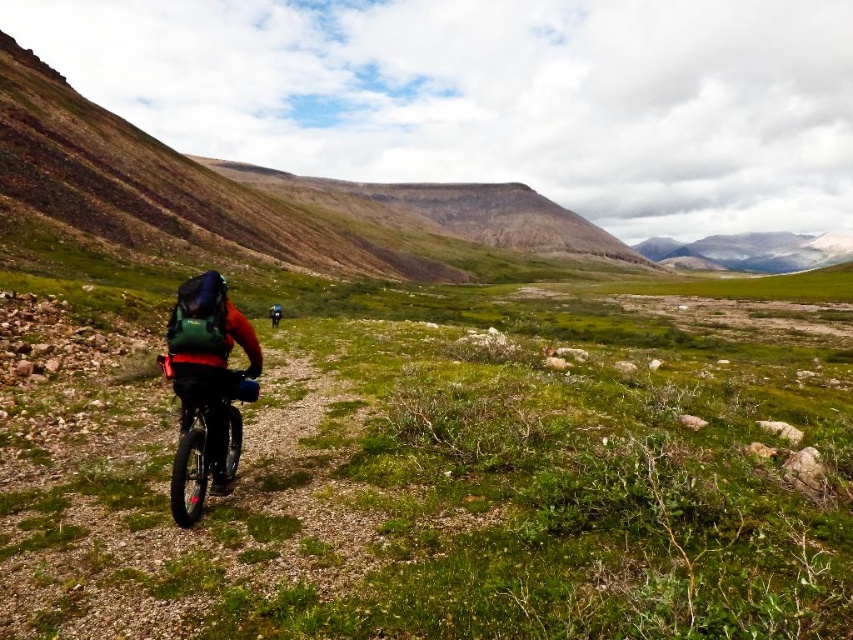
You are a hiker planning to carry both the green matte backpack at center and the shiny black frame at center. If you want to ensure they both fit side by side on your narrow shelf at home, which one should you place closer to the edge of the shelf?

The green matte backpack at center might be wider than the shiny black frame at center, so to fit both on the narrow shelf, place the wider green matte backpack at center near the edge to accommodate its width, then the narrower shiny black frame at center next to it.

You are a hiker planning to carry both the green matte backpack at center and the shiny black frame at center. Which one should you choose if you want to carry more items?

The green matte backpack at center is bigger than the shiny black frame at center, so you should choose the green matte backpack at center to carry more items.